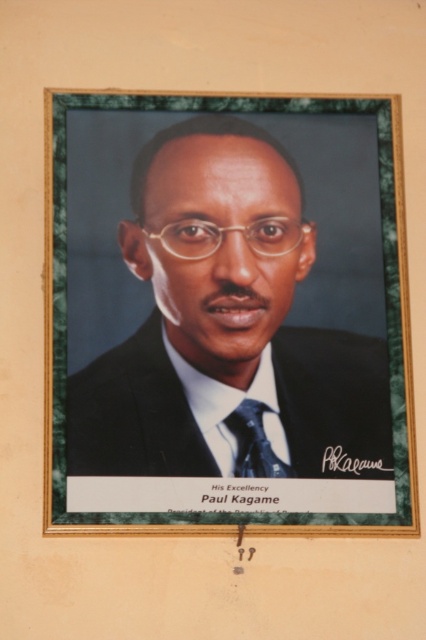
Who is taller, wooden picture frame at center or black silk tie at center?

→ wooden picture frame at center is taller.

Who is more forward, (x=363, y=380) or (x=271, y=452)?

Point (x=271, y=452)

Where is `wooden picture frame at center`? The height and width of the screenshot is (640, 426). wooden picture frame at center is located at coordinates (226, 312).

Between point (135, 353) and point (229, 428), which one is positioned in front?

Positioned in front is point (229, 428).

Does black satin business suit at center have a lesser width compared to black silk tie at center?

No, black satin business suit at center is not thinner than black silk tie at center.

This screenshot has height=640, width=426. Identify the location of black satin business suit at center. (134, 413).

Which of these two, wooden picture frame at center or black satin business suit at center, stands shorter?

Standing shorter between the two is black satin business suit at center.

Between wooden picture frame at center and black satin business suit at center, which one is positioned lower?

Positioned lower is black satin business suit at center.

Locate an element on the screen. wooden picture frame at center is located at coordinates (226, 312).